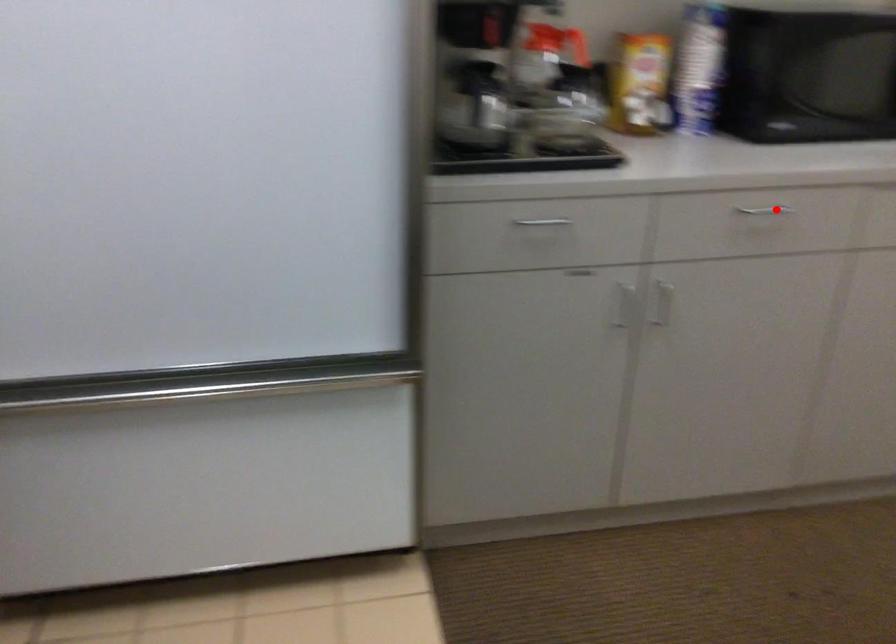
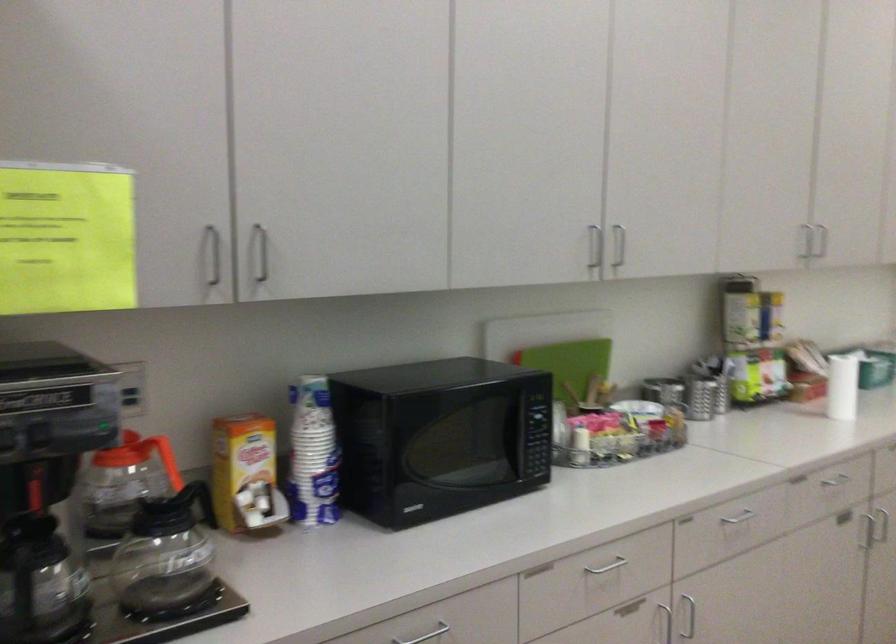
In the second image, find the point that corresponds to the highlighted location in the first image.

(425, 635)